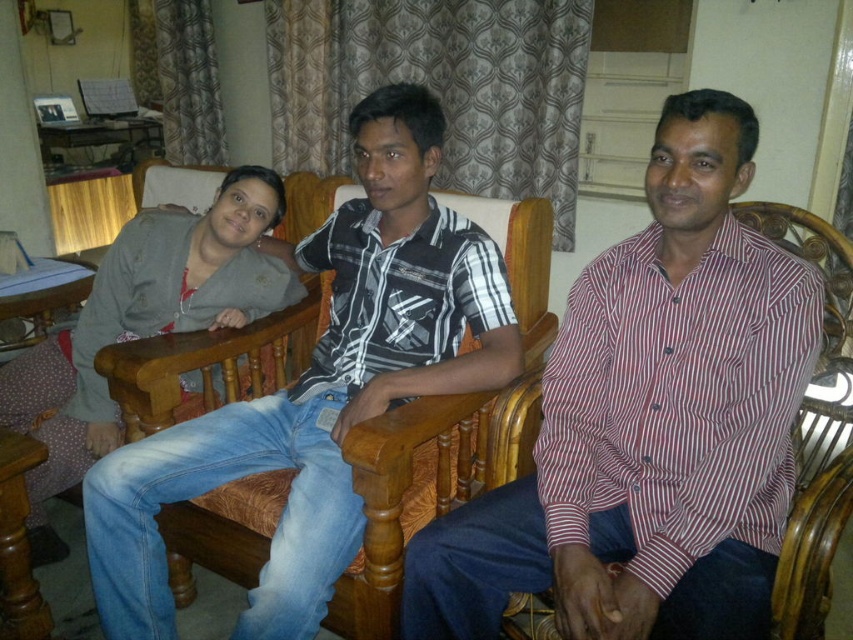
You are a photographer trying to capture the striped cotton shirt at right in your frame. The camera you are using has a focal length of 50mm. Given that the point at coordinates (648, 422) marks the position of the striped cotton shirt at right, can you estimate if the shirt will be within the camera frame?

The point at coordinates (648, 422) marks the position of the striped cotton shirt at right, so yes, the shirt will be within the camera frame as it is precisely marked by the given coordinates.

You are a delivery robot with a package that is 1 meter long. You need to place it between the striped cotton shirt at right and the matte gray sweater at left. Is there enough space for the package?

The distance between the striped cotton shirt at right and the matte gray sweater at left is 96.59 centimeters. Since the package is 1 meter long, which is 100 centimeters, there is not enough space to place the package between them.

You are a photographer setting up a tripod between the striped cotton shirt at right and the striped cotton shirt at center. The tripod requires a minimum of 12 inches between the two shirts to fit. Will the space between them accommodate the tripod?

The distance between the striped cotton shirt at right and the striped cotton shirt at center is 14.24 inches, which is more than the required 12 inches. Therefore, the tripod will fit comfortably between them.